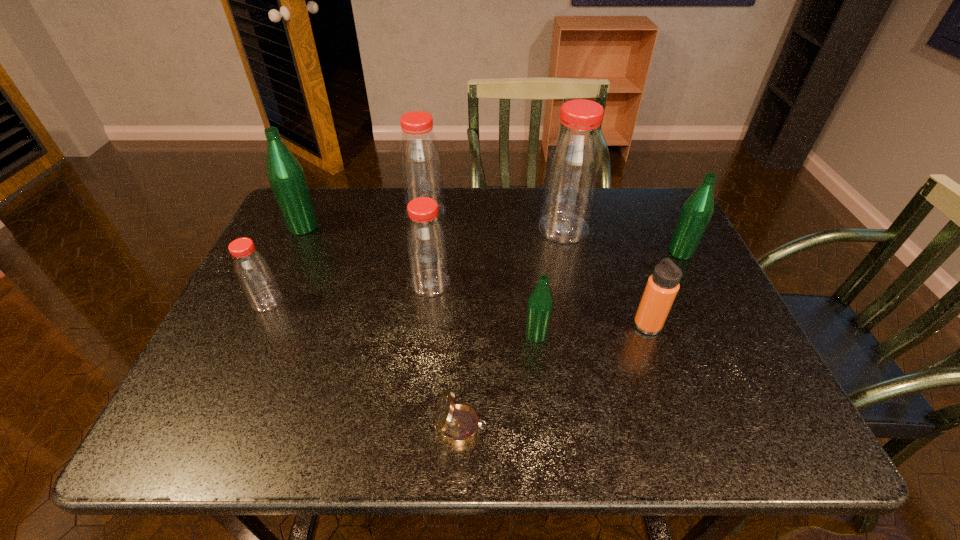
I want to click on the tallest bottle, so click(573, 166).

Image resolution: width=960 pixels, height=540 pixels. Identify the location of the seventh object from left to right. (573, 166).

Identify the location of the second biggest red bottle. (420, 160).

This screenshot has width=960, height=540. In order to click on the leftmost green bottle in this screenshot , I will do `click(286, 176)`.

The height and width of the screenshot is (540, 960). What are the coordinates of `the farthest green bottle` in the screenshot? It's located at (286, 176).

You are a GUI agent. You are given a task and a screenshot of the screen. Output one action in this format:
    pyautogui.click(x=<x>, y=<y>)
    Task: Click on the third biggest red bottle
    
    Given the screenshot: What is the action you would take?
    pyautogui.click(x=426, y=245)

Identify the location of the second nearest green bottle. (697, 210).

Find the location of a particular element. This screenshot has height=540, width=960. the rightmost bottle is located at coordinates (697, 210).

Where is `thermos bottle`? Image resolution: width=960 pixels, height=540 pixels. thermos bottle is located at coordinates (662, 286).

Where is `the eighth object from left to right`? This screenshot has height=540, width=960. the eighth object from left to right is located at coordinates (662, 286).